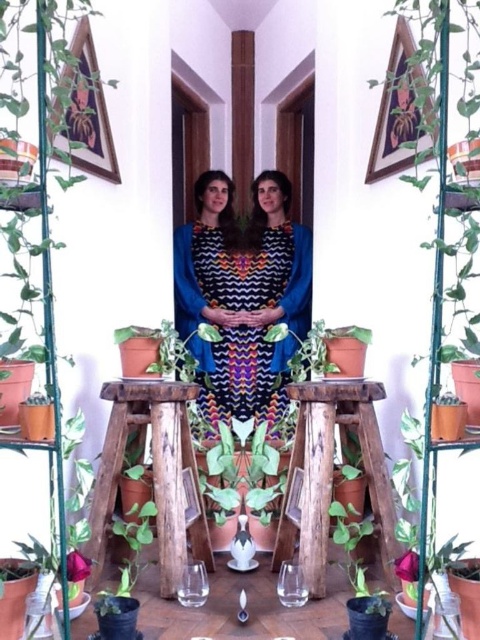
Who is positioned more to the right, green leafy plant at center or green matte plant at lower center?

green leafy plant at center

Between green leafy plant at center and green matte plant at lower center, which one has less height?

With less height is green matte plant at lower center.

Who is more forward, (448,289) or (345,518)?

Point (448,289) is more forward.

This screenshot has width=480, height=640. In order to click on green leafy plant at center in this screenshot , I will do `click(446, 216)`.

Who is more forward, (x=60, y=182) or (x=307, y=474)?

Positioned in front is point (x=60, y=182).

Between point (49, 44) and point (372, 404), which one is positioned in front?

Point (49, 44) is more forward.

The image size is (480, 640). Identify the location of green leafy plant at left. (33, 228).

Is wooden stool at center bigger than rustic wood stool at center?

Indeed, wooden stool at center has a larger size compared to rustic wood stool at center.

Is wooden stool at center further to camera compared to rustic wood stool at center?

No, it is not.

Where is `wooden stool at center`? wooden stool at center is located at coordinates (153, 474).